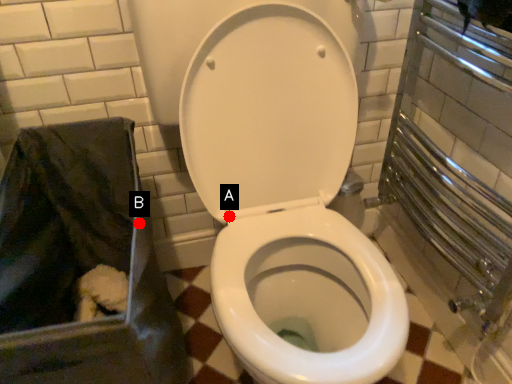
Question: Two points are circled on the image, labeled by A and B beside each circle. Which point appears farthest from the camera in this image?

Choices:
 (A) A is further
 (B) B is further

Answer: (A)